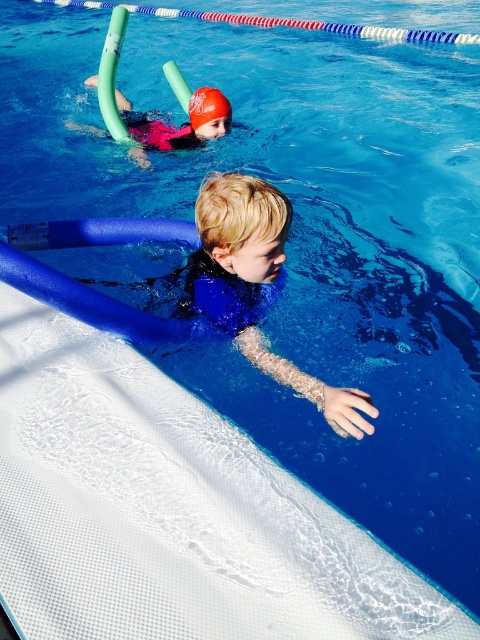
Question: Is matte pink swim cap at upper center smaller than pink matte life jacket at upper center?

Choices:
 (A) yes
 (B) no

Answer: (B)

Question: Does blue rubber vest at lower center appear on the right side of matte pink swim cap at upper center?

Choices:
 (A) yes
 (B) no

Answer: (A)

Question: Which object is farther from the camera taking this photo?

Choices:
 (A) blue rubber vest at lower center
 (B) matte pink swim cap at upper center
 (C) pink matte life jacket at upper center

Answer: (C)

Question: Which point is closer to the camera taking this photo?

Choices:
 (A) (199, 141)
 (B) (283, 381)
 (C) (116, 93)

Answer: (B)

Question: Among these objects, which one is nearest to the camera?

Choices:
 (A) matte pink swim cap at upper center
 (B) pink matte life jacket at upper center
 (C) blue rubber vest at lower center

Answer: (C)

Question: Where is blue rubber vest at lower center located in relation to matte pink swim cap at upper center in the image?

Choices:
 (A) left
 (B) right

Answer: (B)